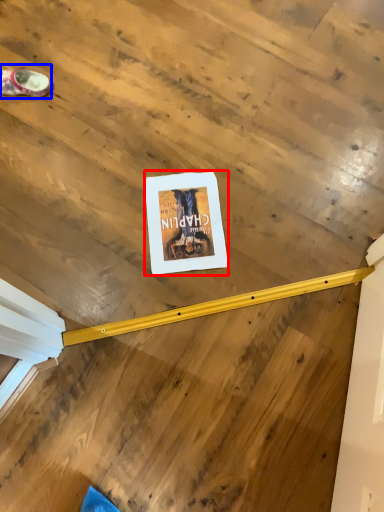
Question: Which point is closer to the camera, poster page (highlighted by a red box) or footwear (highlighted by a blue box)?

Choices:
 (A) poster page
 (B) footwear

Answer: (A)